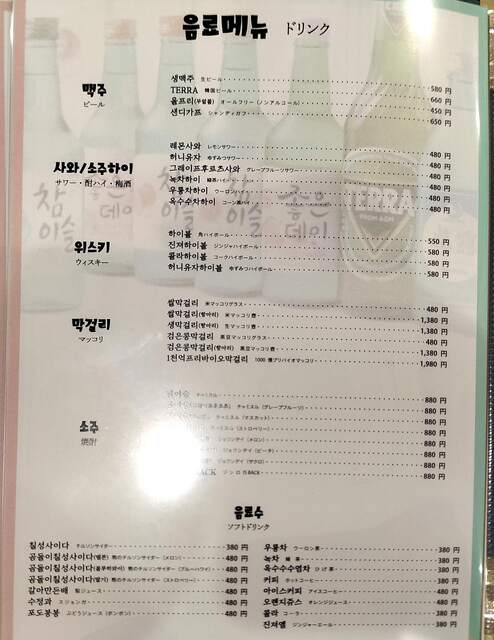
Image resolution: width=494 pixels, height=640 pixels. I want to click on bottle, so click(x=398, y=114), click(x=37, y=65), click(x=119, y=108), click(x=167, y=246), click(x=294, y=253), click(x=229, y=105).